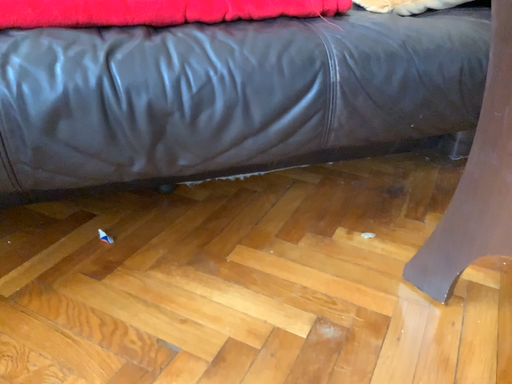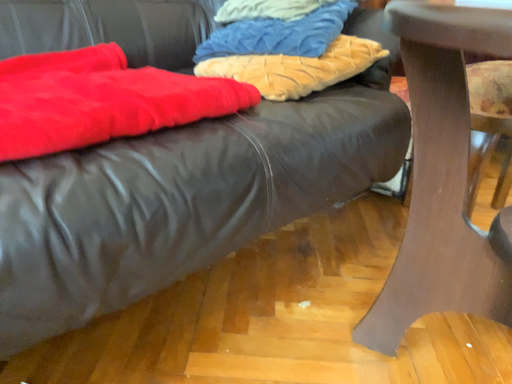
Question: Which way did the camera rotate in the video?

Choices:
 (A) rotated right
 (B) rotated left

Answer: (A)